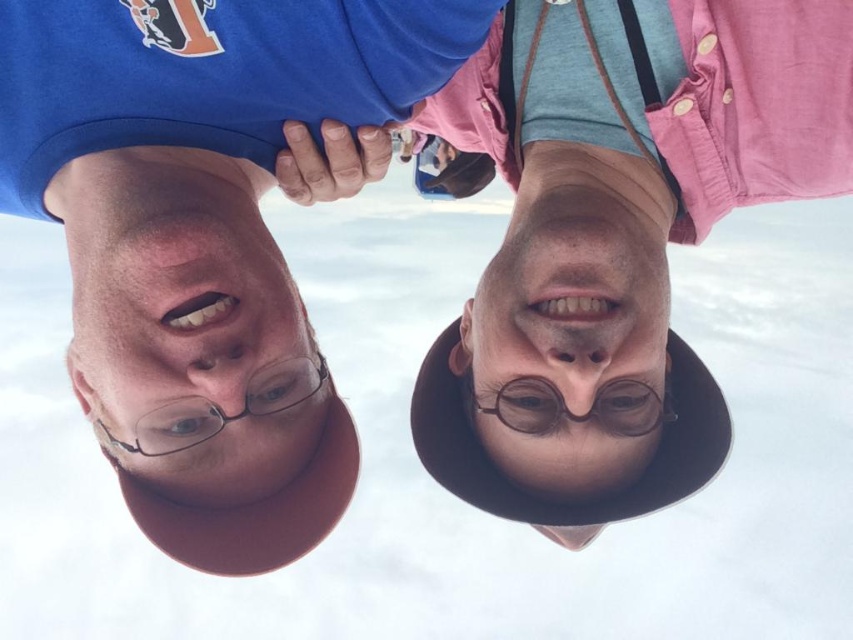
Does pink fabric at upper right have a greater height compared to matte brown face at center?

Correct, pink fabric at upper right is much taller as matte brown face at center.

Who is higher up, pink fabric at upper right or matte brown face at center?

pink fabric at upper right

Is point (614, 484) positioned before point (612, 253)?

No.

The image size is (853, 640). Find the location of `pink fabric at upper right`. pink fabric at upper right is located at coordinates (618, 234).

Is matte skin face at center further to camera compared to matte black glasses at center?

No.

Is point (305, 385) closer to viewer compared to point (608, 406)?

Yes.

Is point (97, 257) farther from viewer compared to point (612, 420)?

No, it is in front of (612, 420).

Find the location of a particular element. matte skin face at center is located at coordinates (187, 330).

Is pink fabric at upper right further to the viewer compared to matte skin face at center?

Yes, pink fabric at upper right is behind matte skin face at center.

Is pink fabric at upper right thinner than matte skin face at center?

In fact, pink fabric at upper right might be wider than matte skin face at center.

You are a GUI agent. You are given a task and a screenshot of the screen. Output one action in this format:
    pyautogui.click(x=<x>, y=<y>)
    Task: Click on the pink fabric at upper right
    
    Given the screenshot: What is the action you would take?
    click(618, 234)

Locate an element on the screen. pink fabric at upper right is located at coordinates (618, 234).